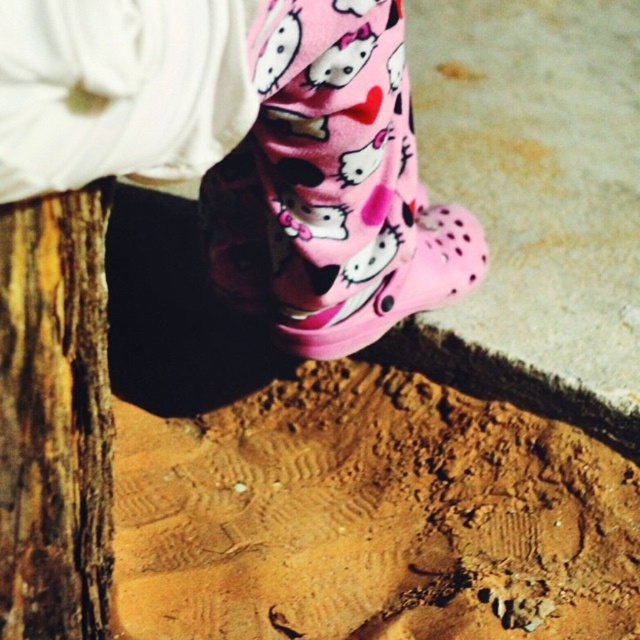
Looking at this image, you are a photographer trying to capture a shot of the pink rubber shoe at center. To avoid including the rough bark tree trunk at lower left in your photo, which direction should you move your camera?

To avoid including the rough bark tree trunk at lower left in your photo, move your camera to the right, away from the tree trunk which is positioned to the left of the pink rubber shoe at center.

You are a parent trying to ensure your child stays within a safe distance from a rough bark tree trunk at lower left while playing. Your child is currently standing at the pink rubber shoe at center. How far apart are the two objects?

The rough bark tree trunk at lower left and the pink rubber shoe at center are 57.41 centimeters apart from each other.

You are a parent trying to measure the distance between your child and a wooden fence to ensure safety. The child is standing at point (20, 577). How far apart are they in centimeters?

The distance between the child and the wooden fence is 82.40 centimeters.